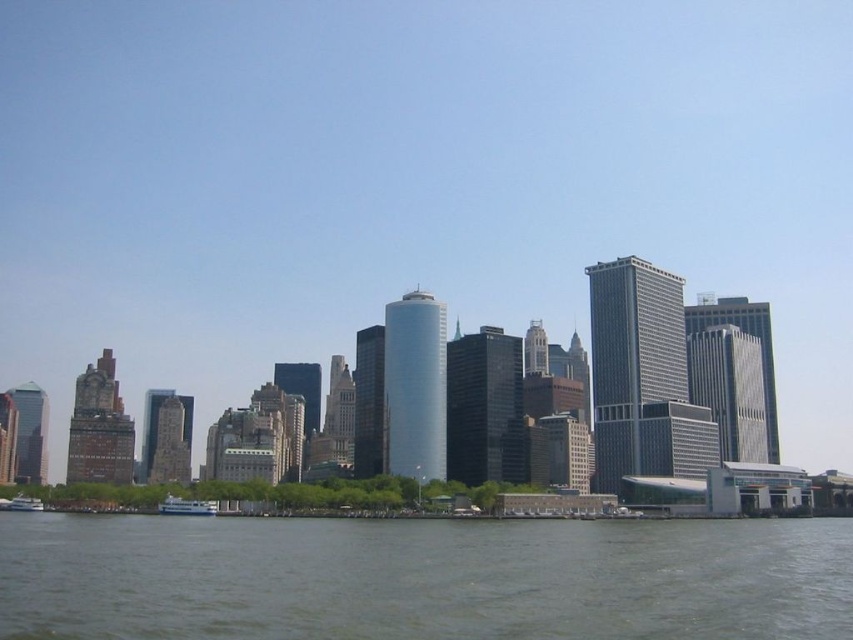
You are a tourist standing on the shore looking at the gray water at lower center and the white glossy ferry at lower center. Which object is positioned to the right side?

The gray water at lower center is positioned to the right of the white glossy ferry at lower center.

You are a photographer trying to capture the skyline from the white glossy ferry at lower center. Based on the coordinates provided, what is the exact 2D location of the ferry?

The white glossy ferry at lower center is located at the 2D coordinates of point (186, 506).

From the picture: Based on the scene description, what is located at the coordinates point (422, 579)?

The gray water at lower center is located at point (422, 579).